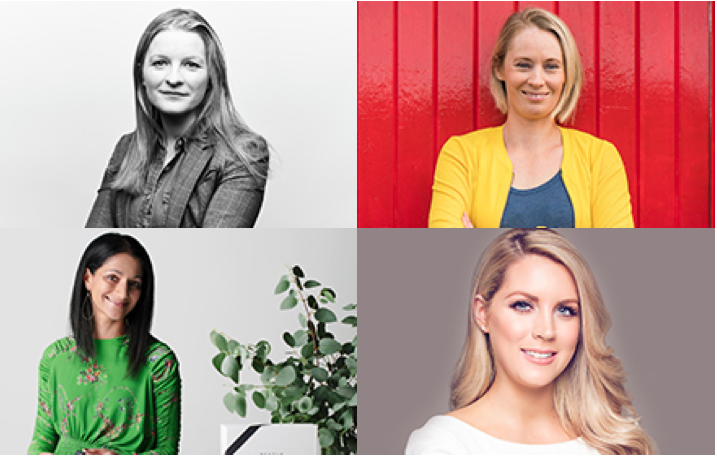
Where is `photographs`? This screenshot has height=457, width=717. photographs is located at coordinates (300, 165), (411, 168), (315, 254), (404, 267).